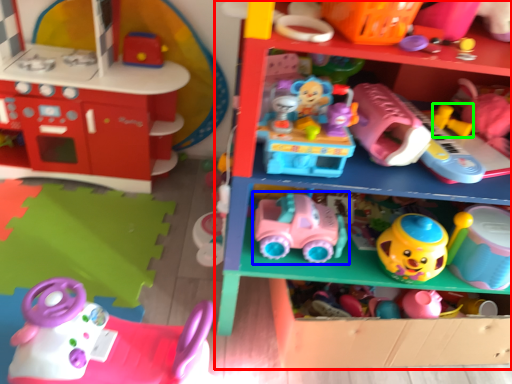
Question: Considering the real-world distances, which object is closest to shelf (highlighted by a red box)? toy (highlighted by a blue box) or toy (highlighted by a green box).

Choices:
 (A) toy
 (B) toy

Answer: (A)